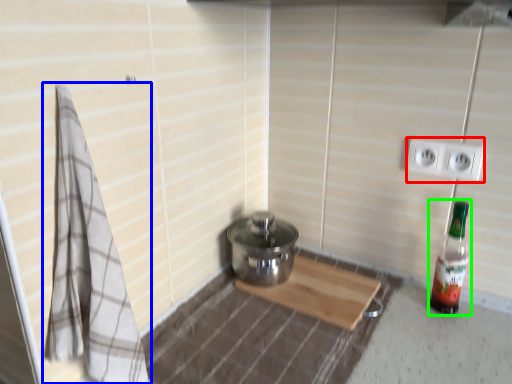
Question: Which is nearer to the electric outlet (highlighted by a red box)? bath towel (highlighted by a blue box) or bottle (highlighted by a green box).

Choices:
 (A) bath towel
 (B) bottle

Answer: (B)